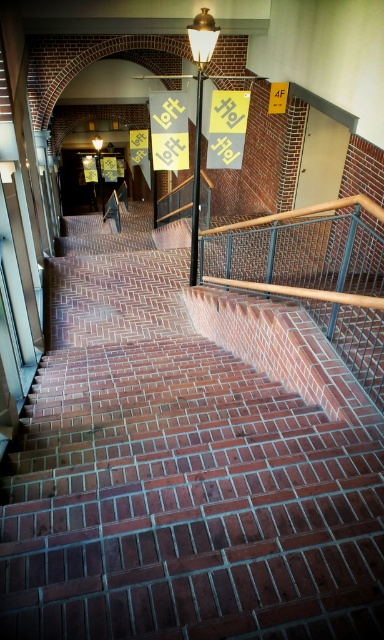
Does point (99, 600) come behind point (241, 236)?

No, (99, 600) is in front of (241, 236).

Which is behind, point (248, 360) or point (261, 273)?

Point (261, 273)

The height and width of the screenshot is (640, 384). I want to click on brick stairs at center, so click(183, 468).

Is point (304, 467) closer to viewer compared to point (241, 106)?

That is True.

In the scene shown: Can you confirm if brick stairs at center is wider than yellow paper sign at center?

No, brick stairs at center is not wider than yellow paper sign at center.

In the scene shown: Measure the distance between point [339,456] and camera.

Point [339,456] is 9.03 feet from camera.

Find the location of `brick stairs at center`. brick stairs at center is located at coordinates (183, 468).

This screenshot has width=384, height=640. Describe the element at coordinates (314, 273) in the screenshot. I see `brown metal/rail at center` at that location.

Is brown metal/rail at center to the right of yellow paper sign at left from the viewer's perspective?

Yes, brown metal/rail at center is to the right of yellow paper sign at left.

What do you see at coordinates (314, 273) in the screenshot?
I see `brown metal/rail at center` at bounding box center [314, 273].

Identify the location of brown metal/rail at center. The image size is (384, 640). (314, 273).